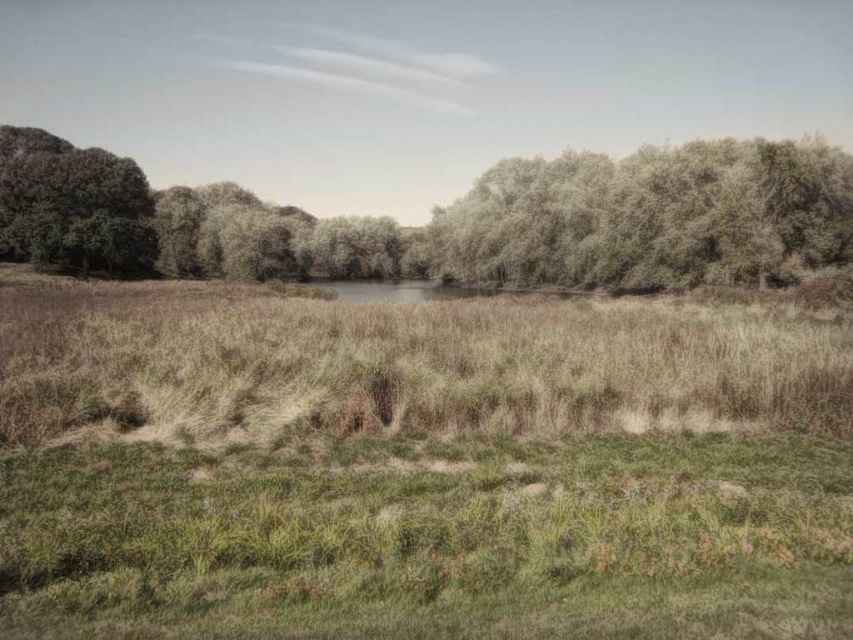
Between green grassy field at center and green leafy trees at upper center, which one is positioned higher?

green leafy trees at upper center is higher up.

Which is more to the left, green grassy field at center or green leafy trees at upper center?

green grassy field at center is more to the left.

Image resolution: width=853 pixels, height=640 pixels. I want to click on green grassy field at center, so click(418, 467).

What are the coordinates of `green grassy field at center` in the screenshot? It's located at click(x=418, y=467).

Which is more to the left, green leafy trees at upper center or green leafy tree at upper left?

green leafy tree at upper left is more to the left.

Can you confirm if green leafy trees at upper center is bigger than green leafy tree at upper left?

Indeed, green leafy trees at upper center has a larger size compared to green leafy tree at upper left.

Is point (560, 257) closer to viewer compared to point (67, 221)?

No, it is not.

Locate an element on the screen. This screenshot has width=853, height=640. green leafy trees at upper center is located at coordinates (451, 220).

Based on the photo, how far apart are green grassy field at center and green leafy tree at upper left?

green grassy field at center is 42.40 meters from green leafy tree at upper left.

Does green grassy field at center appear on the right side of green leafy tree at upper left?

Indeed, green grassy field at center is positioned on the right side of green leafy tree at upper left.

Is point (59, 598) less distant than point (123, 202)?

Yes, it is.

Locate an element on the screen. The height and width of the screenshot is (640, 853). green grassy field at center is located at coordinates (418, 467).